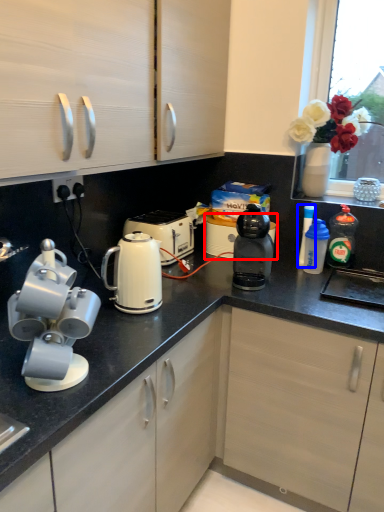
Question: Which object is closer to the camera taking this photo, appliance (highlighted by a red box) or kitchen appliance (highlighted by a blue box)?

Choices:
 (A) appliance
 (B) kitchen appliance

Answer: (B)